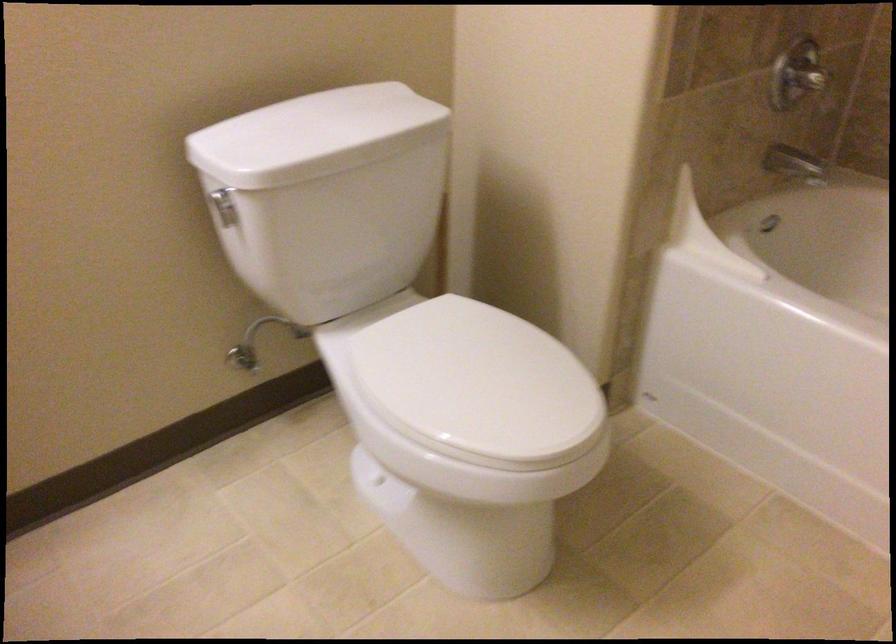
Where is `white toilet seat`? This screenshot has height=644, width=896. white toilet seat is located at coordinates (442, 363).